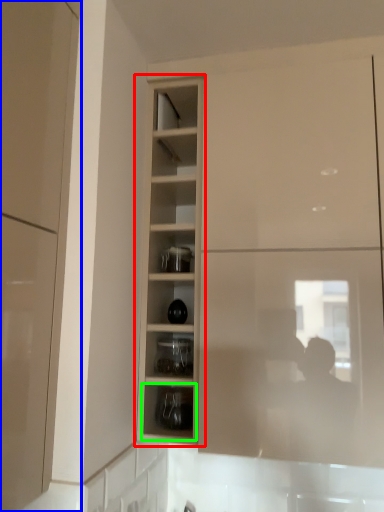
Question: Based on their relative distances, which object is nearer to cupboard (highlighted by a red box)? Choose from cabinetry (highlighted by a blue box) and shelf (highlighted by a green box).

Choices:
 (A) cabinetry
 (B) shelf

Answer: (B)